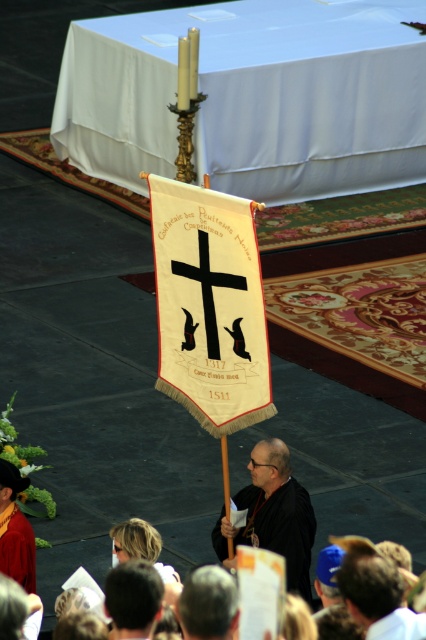
You are a photographer trying to capture the scene. You need to adjust your camera settings to focus on both the dark brown leather hat at lower right and the dark brown hair at lower center. Which object should you focus on first to ensure proper framing, considering their sizes?

The dark brown leather hat at lower right has a greater width than the dark brown hair at lower center, so you should focus on the dark brown leather hat at lower right first to ensure proper framing.

You are attending the ceremony and want to take a photo of the dark brown leather hat at lower right and the dark brown hair at lower center. Which one is positioned higher in the image?

The dark brown leather hat at lower right is above dark brown hair at lower center.